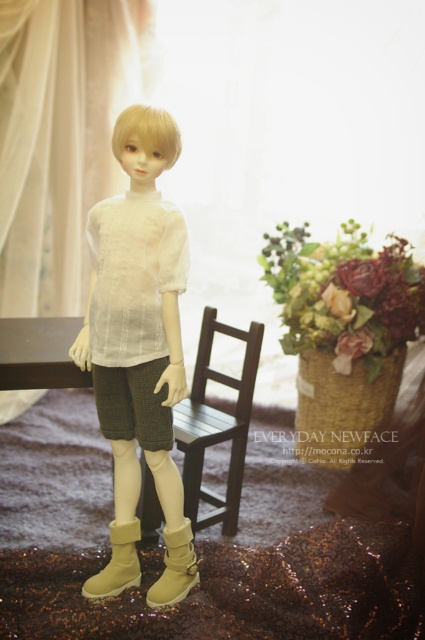
Question: Where is woven straw basket at center located in relation to dark green textured shorts at center in the image?

Choices:
 (A) right
 (B) left

Answer: (A)

Question: Which of the following is the closest to the observer?

Choices:
 (A) matte white shirt at center
 (B) woven straw basket at center
 (C) wooden chair at center
 (D) tan suede boot at lower center

Answer: (A)

Question: Among these objects, which one is nearest to the camera?

Choices:
 (A) matte white shirt at center
 (B) beige suede boot at lower center
 (C) tan suede boot at lower center
 (D) dark green textured shorts at center

Answer: (A)

Question: Which object is positioned farthest from the wooden chair at center?

Choices:
 (A) dark green textured shorts at center
 (B) woven straw basket at center

Answer: (B)

Question: Does matte white shirt at center lie in front of tan suede boot at lower center?

Choices:
 (A) yes
 (B) no

Answer: (A)

Question: Is dark green textured shorts at center below tan suede boot at lower center?

Choices:
 (A) no
 (B) yes

Answer: (A)